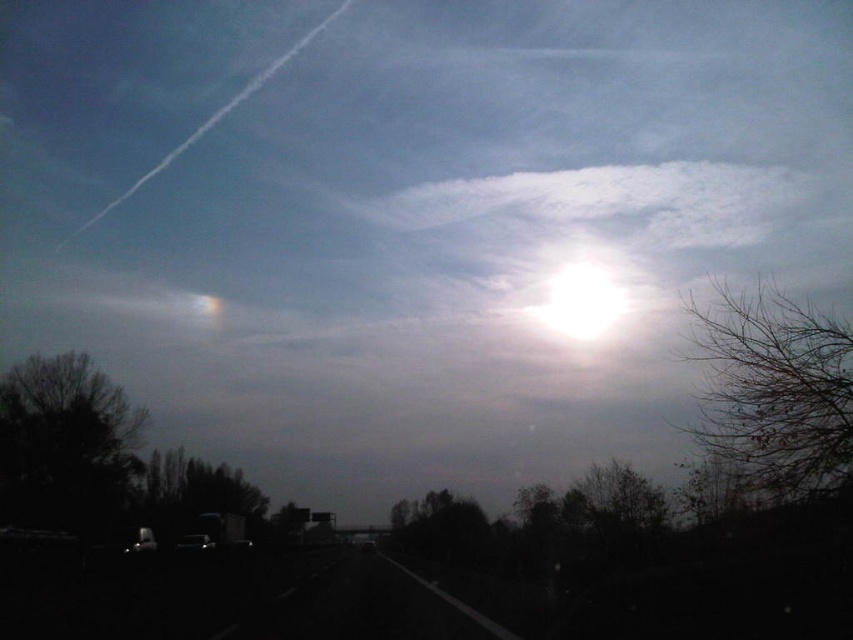
Question: Which of the following is the farthest from the observer?

Choices:
 (A) (646, 168)
 (B) (93, 509)
 (C) (556, 273)
 (D) (827, 378)

Answer: (A)

Question: Which object is farther from the camera taking this photo?

Choices:
 (A) bright white cloud at upper center
 (B) bare branches at right

Answer: (A)

Question: In this image, where is bare branches at right located relative to white fluffy cloud at upper center?

Choices:
 (A) below
 (B) above

Answer: (A)

Question: Does dark green leafy tree at left appear on the right side of bright white cloud at upper center?

Choices:
 (A) yes
 (B) no

Answer: (B)

Question: Can you confirm if bare branches at right is positioned above dark green leafy tree at left?

Choices:
 (A) yes
 (B) no

Answer: (A)

Question: Among these points, which one is farthest from the camera?

Choices:
 (A) (430, 220)
 (B) (848, 353)
 (C) (74, 460)

Answer: (A)